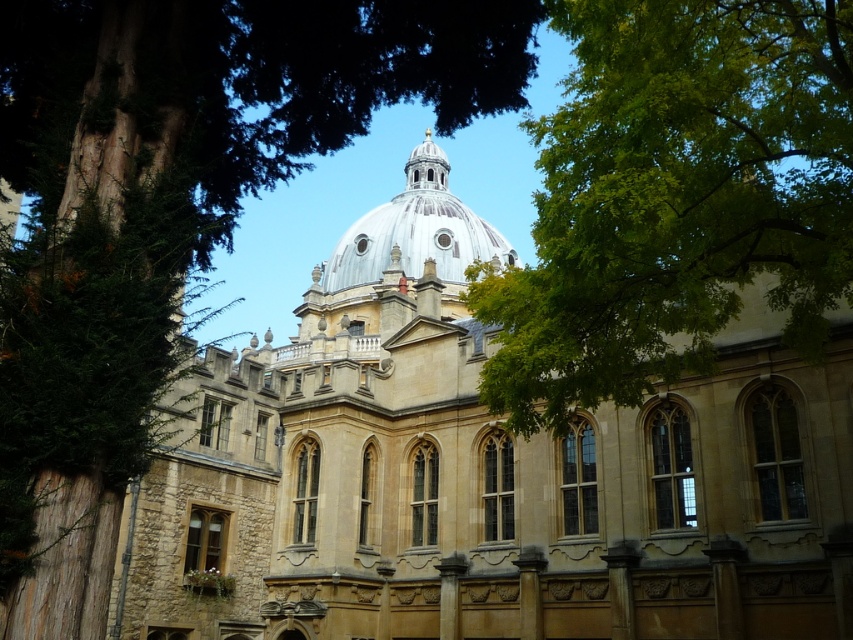
Identify the location of green leafy tree at upper left. (167, 218).

Does green leafy tree at upper left appear over green leafy tree at upper center?

Indeed, green leafy tree at upper left is positioned over green leafy tree at upper center.

Between point (167, 294) and point (664, 108), which one is positioned behind?

Point (167, 294)

At what (x,y) coordinates should I click in order to perform the action: click on green leafy tree at upper left. Please return your answer as a coordinate pair (x, y). Looking at the image, I should click on (167, 218).

Based on the photo, between light brown stone church at center and white stone dome at center, which one has less height?

With less height is white stone dome at center.

Between point (410, 481) and point (454, 276), which one is positioned in front?

Positioned in front is point (410, 481).

Locate an element on the screen. light brown stone church at center is located at coordinates (485, 474).

Identify the location of light brown stone church at center. This screenshot has height=640, width=853. (485, 474).

What do you see at coordinates (167, 218) in the screenshot?
I see `green leafy tree at upper left` at bounding box center [167, 218].

Where is `green leafy tree at upper left`? The width and height of the screenshot is (853, 640). green leafy tree at upper left is located at coordinates (167, 218).